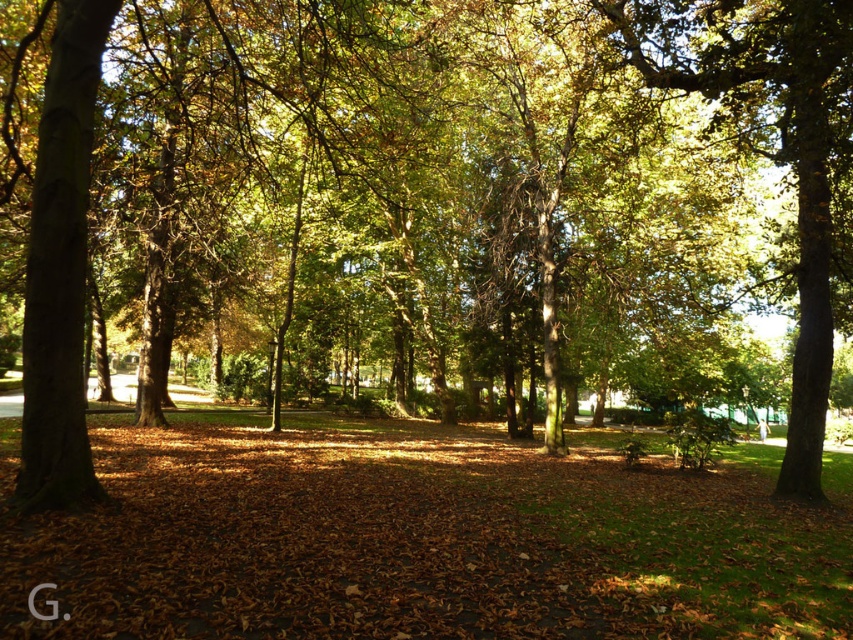
You are a gardener planning to plant a new tree in the park. You notice the brown leaf litter at center and the green leafy tree at center. Which object is wider in the image?

The brown leaf litter at center is wider than the green leafy tree at center according to the description.

You are a park visitor walking along the path in the park. You see the brown leaf litter at center and the green leafy tree at center. Which object is closer to the ground?

The brown leaf litter at center is closer to the ground because it is located below the green leafy tree at center.

You are a gardener trying to clear the park path. You see the brown leaf litter at center and the green leafy tree at center. Which object takes up more space on the path?

The brown leaf litter at center is bigger than the green leafy tree at center, so it takes up more space on the path.